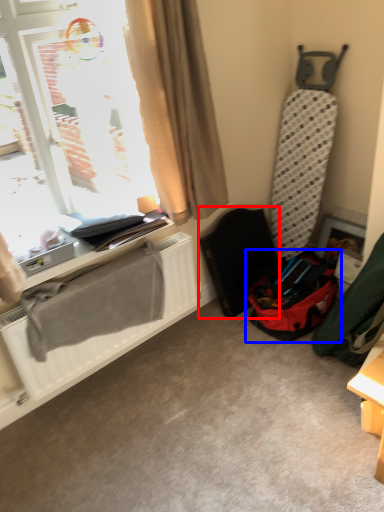
Question: Which of the following is the closest to the observer, folding chair (highlighted by a red box) or luggage and bags (highlighted by a blue box)?

Choices:
 (A) folding chair
 (B) luggage and bags

Answer: (B)